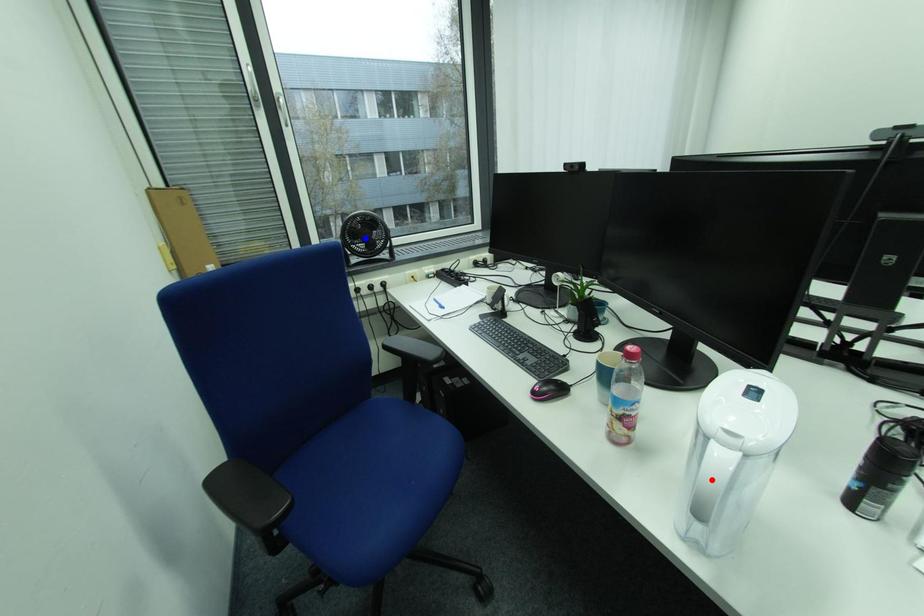
Question: Which of the two points in the image is closer to the camera?

Choices:
 (A) Blue point is closer.
 (B) Red point is closer.

Answer: (B)